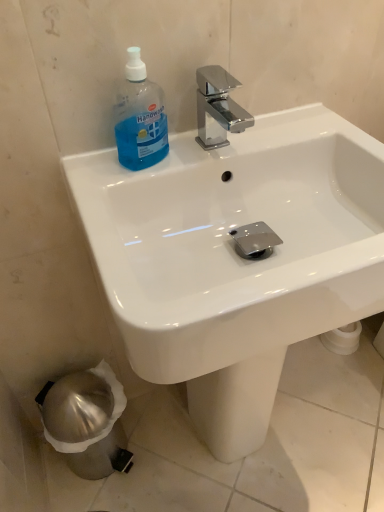
Question: Are white glossy sink at center and blue translucent plastic handwash at upper left beside each other?

Choices:
 (A) no
 (B) yes

Answer: (A)

Question: Does white glossy sink at center have a lesser height compared to blue translucent plastic handwash at upper left?

Choices:
 (A) yes
 (B) no

Answer: (B)

Question: Is blue translucent plastic handwash at upper left at the back of white glossy sink at center?

Choices:
 (A) no
 (B) yes

Answer: (B)

Question: Considering the relative positions of white glossy sink at center and blue translucent plastic handwash at upper left in the image provided, is white glossy sink at center to the left of blue translucent plastic handwash at upper left from the viewer's perspective?

Choices:
 (A) yes
 (B) no

Answer: (B)

Question: Would you say white glossy sink at center is outside blue translucent plastic handwash at upper left?

Choices:
 (A) yes
 (B) no

Answer: (A)

Question: From a real-world perspective, is white glossy sink at center on top of blue translucent plastic handwash at upper left?

Choices:
 (A) no
 (B) yes

Answer: (A)

Question: From the image's perspective, would you say blue translucent plastic handwash at upper left is positioned over white glossy sink at center?

Choices:
 (A) no
 (B) yes

Answer: (B)

Question: Is blue translucent plastic handwash at upper left at the right side of white glossy sink at center?

Choices:
 (A) yes
 (B) no

Answer: (B)

Question: Would you say blue translucent plastic handwash at upper left is a long distance from white glossy sink at center?

Choices:
 (A) yes
 (B) no

Answer: (B)

Question: Is blue translucent plastic handwash at upper left facing away from white glossy sink at center?

Choices:
 (A) no
 (B) yes

Answer: (B)

Question: Does blue translucent plastic handwash at upper left have a greater height compared to white glossy sink at center?

Choices:
 (A) yes
 (B) no

Answer: (B)

Question: From a real-world perspective, is blue translucent plastic handwash at upper left located higher than white glossy sink at center?

Choices:
 (A) no
 (B) yes

Answer: (B)

Question: In terms of size, does blue translucent plastic handwash at upper left appear bigger or smaller than white glossy sink at center?

Choices:
 (A) small
 (B) big

Answer: (A)